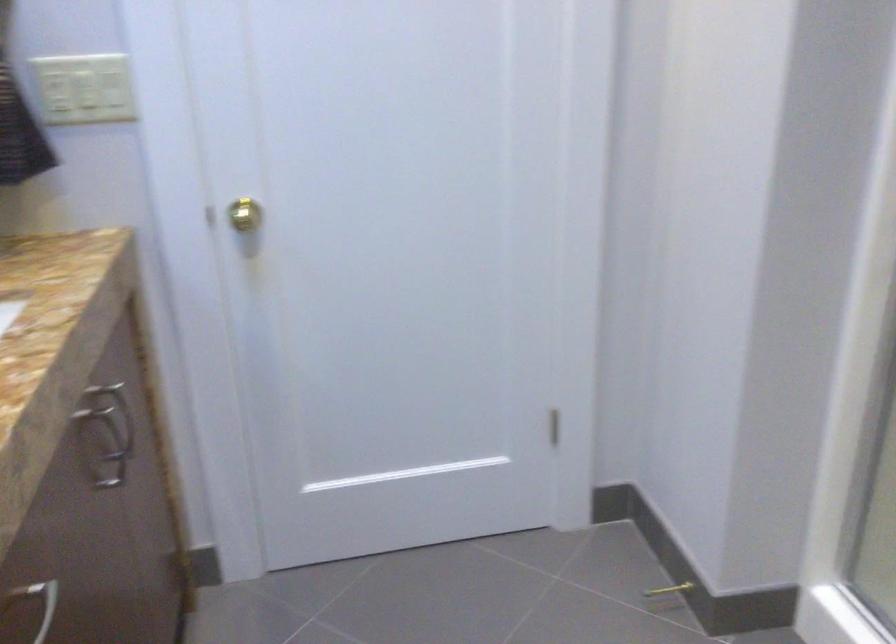
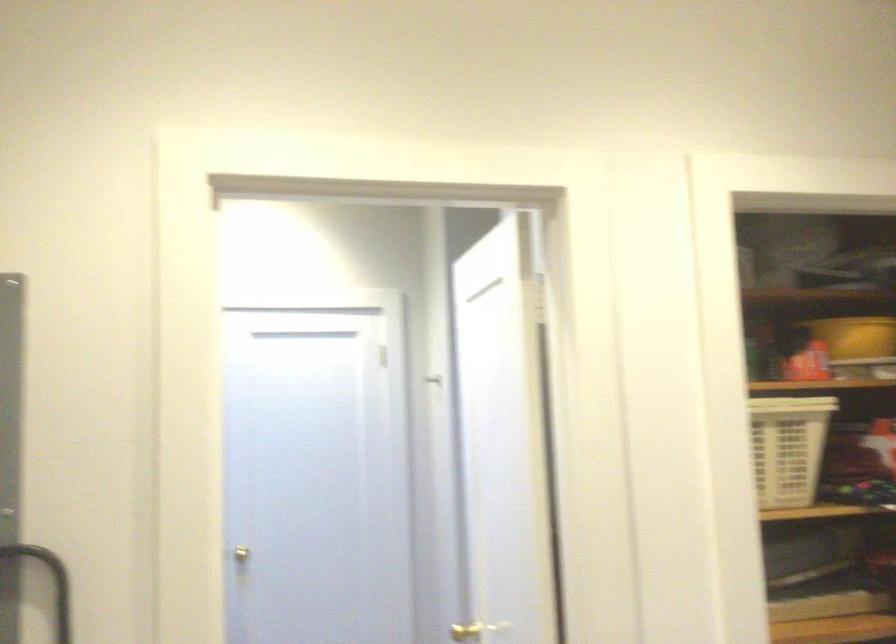
In the second image, find the point that corresponds to [256,211] in the first image.

(253, 553)